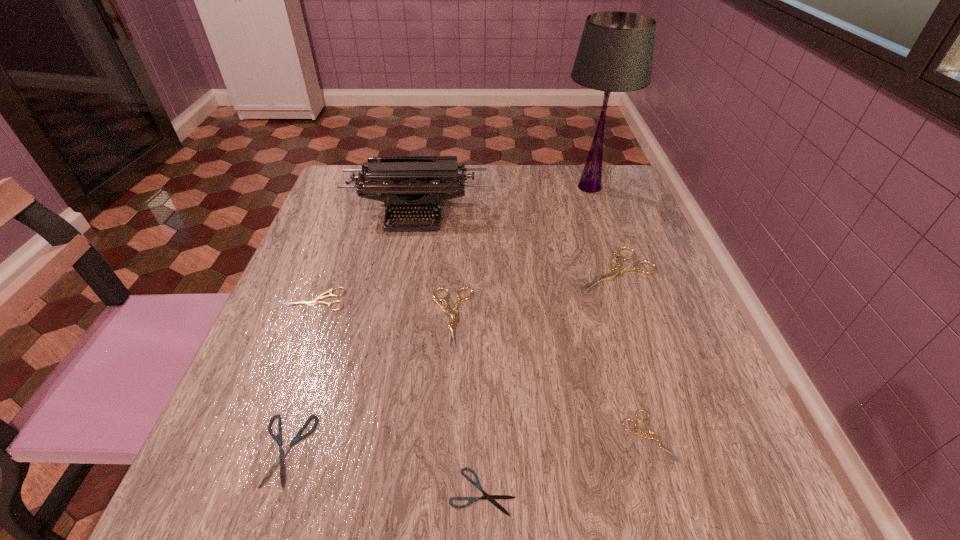
In order to click on lampshade in this screenshot , I will do `click(615, 54)`.

What are the coordinates of `typewriter` in the screenshot? It's located at (388, 179).

This screenshot has height=540, width=960. I want to click on the tallest shears, so click(x=615, y=272).

At what (x,y) coordinates should I click in order to perform the action: click on the biggest beige shears. Please return your answer as a coordinate pair (x, y). This screenshot has height=540, width=960. Looking at the image, I should click on (615, 272).

The height and width of the screenshot is (540, 960). Find the location of `the fifth shortest shears`. the fifth shortest shears is located at coordinates (454, 314).

Identify the location of the second beige shears from left to right. The width and height of the screenshot is (960, 540). (454, 314).

The height and width of the screenshot is (540, 960). What are the coordinates of `the fourth shortest object` in the screenshot? It's located at (315, 301).

Where is `the second smallest beige shears`? The width and height of the screenshot is (960, 540). the second smallest beige shears is located at coordinates (315, 301).

Identify the location of the smallest beige shears. (651, 435).

Where is `the left black shears`? the left black shears is located at coordinates (282, 452).